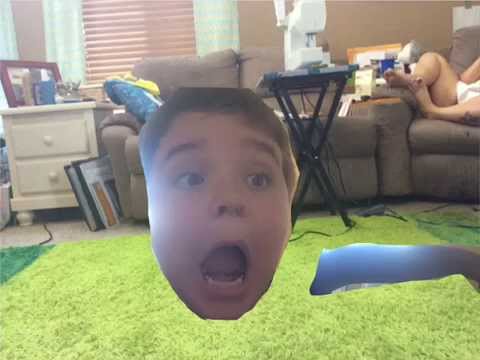
Where is `green carpet`? This screenshot has height=360, width=480. green carpet is located at coordinates pos(126,287).